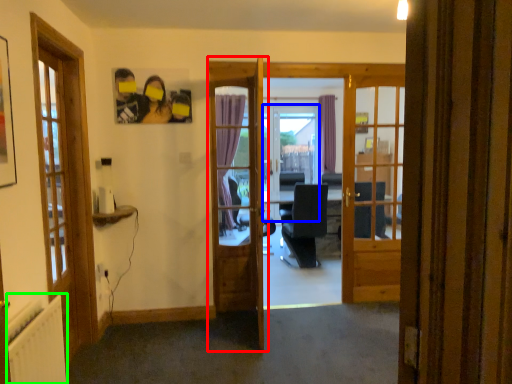
Question: Considering the real-world distances, which object is farthest from door (highlighted by a red box)? screen door (highlighted by a blue box) or radiator (highlighted by a green box)?

Choices:
 (A) screen door
 (B) radiator

Answer: (A)